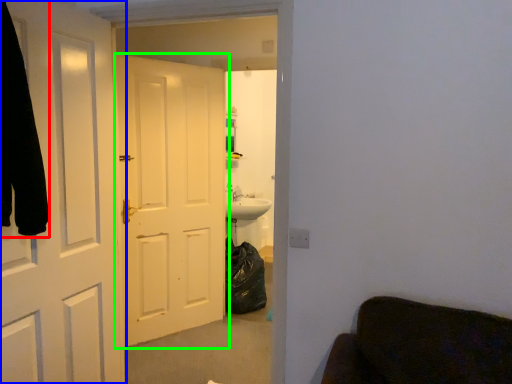
Question: Considering the real-world distances, which object is farthest from robe (highlighted by a red box)? door (highlighted by a blue box) or door (highlighted by a green box)?

Choices:
 (A) door
 (B) door

Answer: (B)